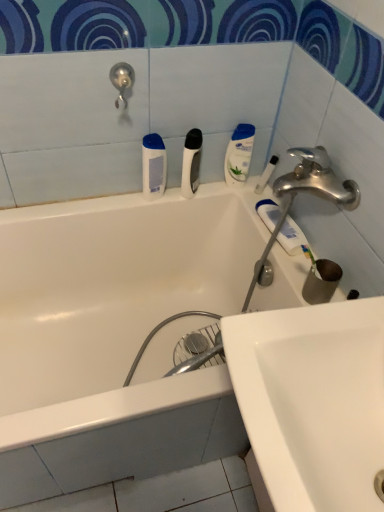
At what (x,y) coordinates should I click in order to perform the action: click on vacant space positioned to the left of white matte toothpaste at upper right. Please return your answer as a coordinate pair (x, y). Looking at the image, I should click on (245, 210).